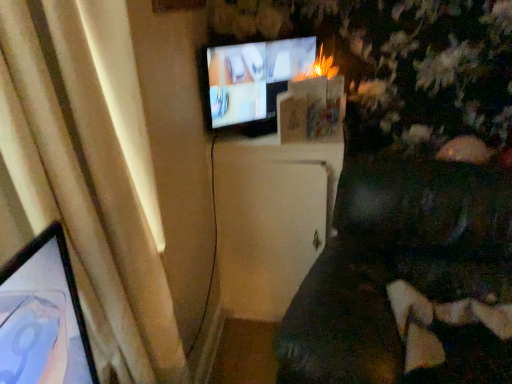
Question: Considering the relative sizes of matte black tv at upper center and beige fabric curtain at left in the image provided, is matte black tv at upper center bigger than beige fabric curtain at left?

Choices:
 (A) yes
 (B) no

Answer: (B)

Question: From the image's perspective, is matte black tv at upper center over beige fabric curtain at left?

Choices:
 (A) no
 (B) yes

Answer: (B)

Question: Can you confirm if matte black tv at upper center is smaller than beige fabric curtain at left?

Choices:
 (A) yes
 (B) no

Answer: (A)

Question: Can you confirm if matte black tv at upper center is positioned to the left of beige fabric curtain at left?

Choices:
 (A) no
 (B) yes

Answer: (A)

Question: Is matte black tv at upper center shorter than beige fabric curtain at left?

Choices:
 (A) yes
 (B) no

Answer: (A)

Question: In the image, is matte black tv at upper center positioned in front of or behind beige fabric curtain at left?

Choices:
 (A) behind
 (B) front

Answer: (A)

Question: In terms of size, does matte black tv at upper center appear bigger or smaller than beige fabric curtain at left?

Choices:
 (A) small
 (B) big

Answer: (A)

Question: Considering the positions of matte black tv at upper center and beige fabric curtain at left in the image, is matte black tv at upper center taller or shorter than beige fabric curtain at left?

Choices:
 (A) tall
 (B) short

Answer: (B)

Question: From the image's perspective, relative to beige fabric curtain at left, is matte black tv at upper center above or below?

Choices:
 (A) below
 (B) above

Answer: (B)

Question: Considering the positions of white matte cabinet at center and matte black tv at upper center in the image, is white matte cabinet at center bigger or smaller than matte black tv at upper center?

Choices:
 (A) big
 (B) small

Answer: (A)

Question: From a real-world perspective, is white matte cabinet at center above or below matte black tv at upper center?

Choices:
 (A) above
 (B) below

Answer: (B)

Question: From their relative heights in the image, would you say white matte cabinet at center is taller or shorter than matte black tv at upper center?

Choices:
 (A) short
 (B) tall

Answer: (B)

Question: From the image's perspective, is white matte cabinet at center positioned above or below matte black tv at upper center?

Choices:
 (A) above
 (B) below

Answer: (B)

Question: Relative to matte black tv at upper center, is dark brown fabric couch at lower right in front or behind?

Choices:
 (A) behind
 (B) front

Answer: (B)

Question: Considering the positions of dark brown fabric couch at lower right and matte black tv at upper center in the image, is dark brown fabric couch at lower right wider or thinner than matte black tv at upper center?

Choices:
 (A) thin
 (B) wide

Answer: (B)